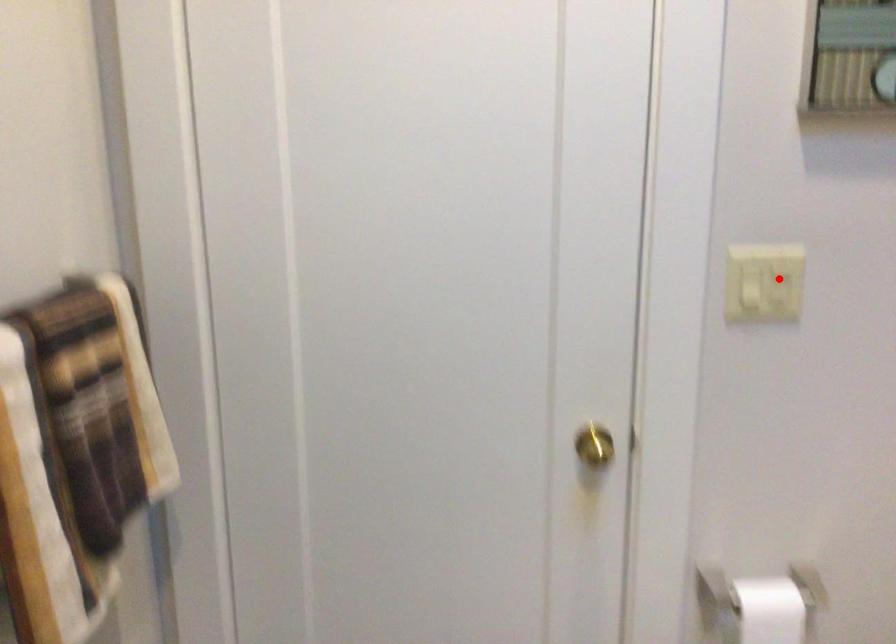
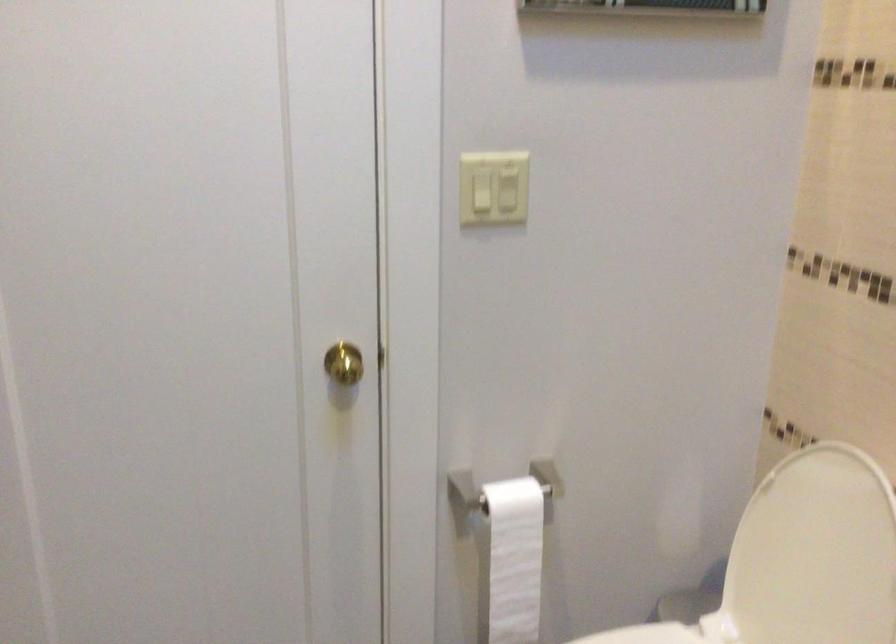
Where in the second image is the point corresponding to the highlighted location from the first image?

(507, 190)